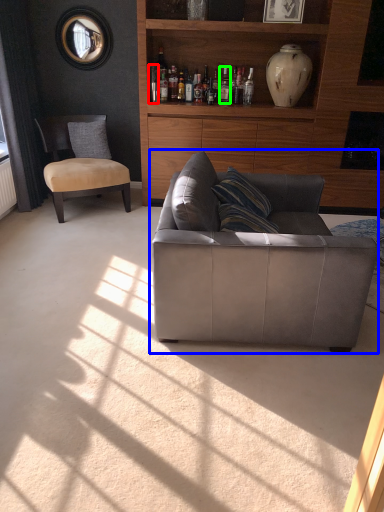
Question: Estimate the real-world distances between objects in this image. Which object is closer to bottle (highlighted by a red box), studio couch (highlighted by a blue box) or bottle (highlighted by a green box)?

Choices:
 (A) studio couch
 (B) bottle

Answer: (B)